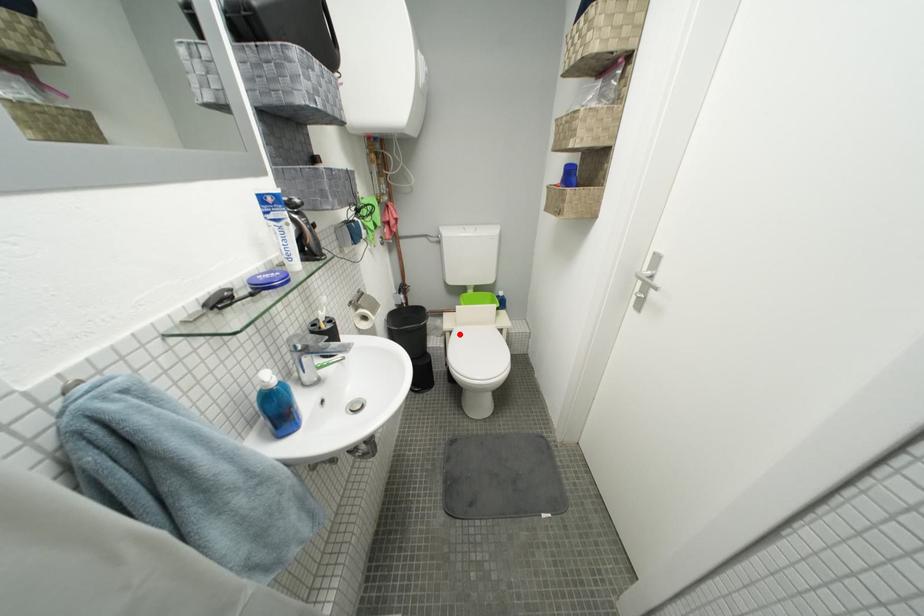
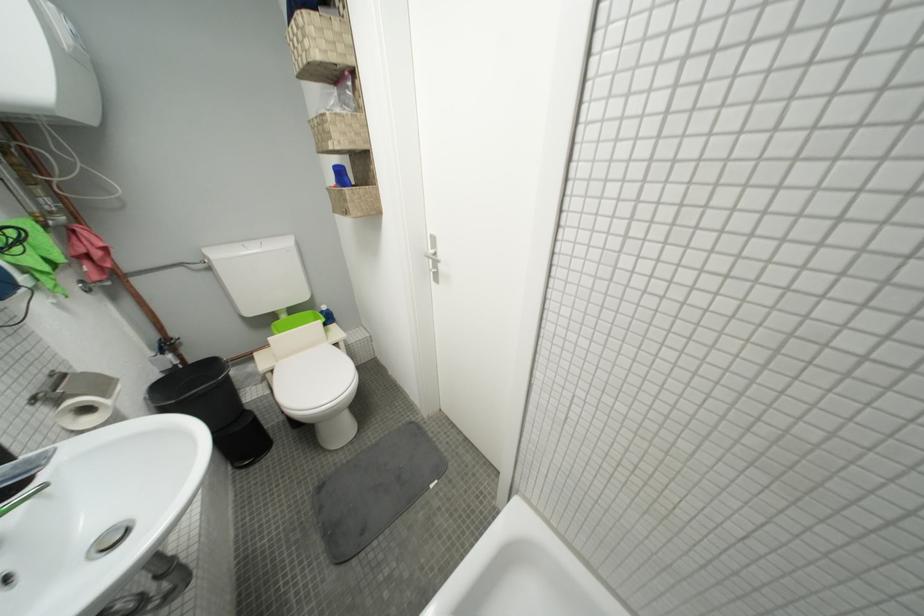
Question: A red point is marked in image1. In image2, is the corresponding 3D point closer to the camera or farther? Reply with the corresponding letter.

Choices:
 (A) The corresponding 3D point is closer.
 (B) The corresponding 3D point is farther.

Answer: (B)